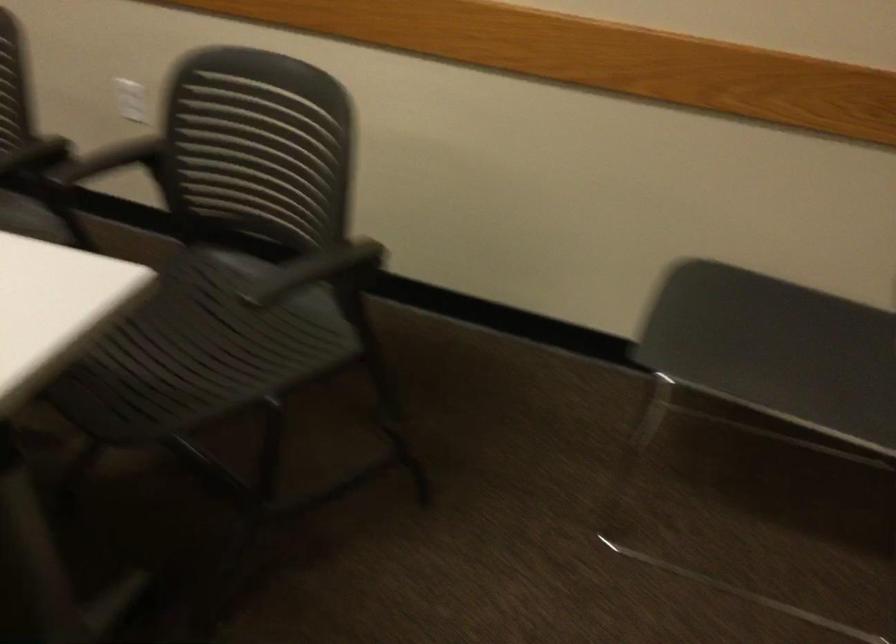
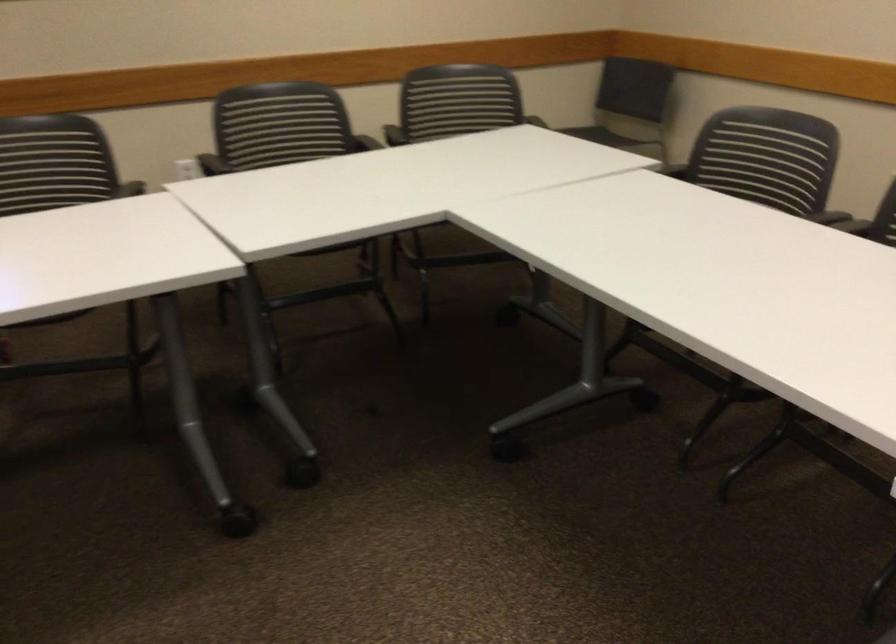
Locate, in the second image, the point that corresponds to pixel 737 228 in the first image.

(529, 113)